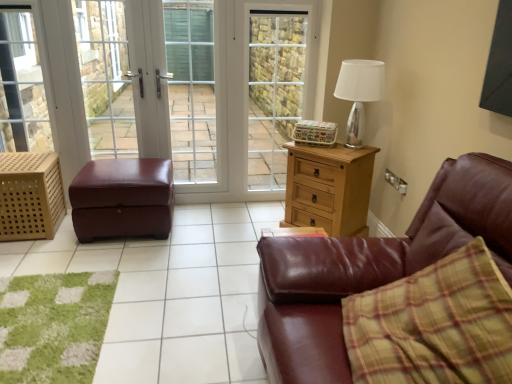
This screenshot has height=384, width=512. In order to click on vacant space situated above wooden lattice basket at left (from a real-world perspective) in this screenshot , I will do (x=28, y=158).